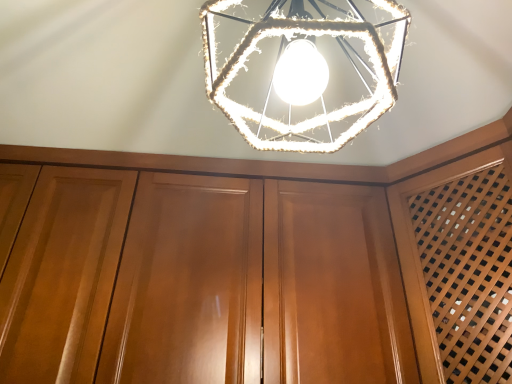
Question: From the image's perspective, does rope-wrapped hexagonal light at center appear lower than glossy wood dresser at center?

Choices:
 (A) yes
 (B) no

Answer: (B)

Question: Is rope-wrapped hexagonal light at center to the right of glossy wood dresser at center from the viewer's perspective?

Choices:
 (A) no
 (B) yes

Answer: (B)

Question: Can you confirm if rope-wrapped hexagonal light at center is taller than glossy wood dresser at center?

Choices:
 (A) yes
 (B) no

Answer: (B)

Question: Does rope-wrapped hexagonal light at center lie in front of glossy wood dresser at center?

Choices:
 (A) no
 (B) yes

Answer: (B)

Question: From the image's perspective, is rope-wrapped hexagonal light at center over glossy wood dresser at center?

Choices:
 (A) yes
 (B) no

Answer: (A)

Question: Is rope-wrapped hexagonal light at center positioned beyond the bounds of glossy wood dresser at center?

Choices:
 (A) no
 (B) yes

Answer: (B)

Question: Does glossy wood dresser at center contain rope-wrapped hexagonal light at center?

Choices:
 (A) yes
 (B) no

Answer: (B)

Question: Is glossy wood dresser at center positioned with its back to rope-wrapped hexagonal light at center?

Choices:
 (A) no
 (B) yes

Answer: (A)

Question: Does glossy wood dresser at center appear on the left side of rope-wrapped hexagonal light at center?

Choices:
 (A) no
 (B) yes

Answer: (B)

Question: Is glossy wood dresser at center not close to rope-wrapped hexagonal light at center?

Choices:
 (A) yes
 (B) no

Answer: (B)

Question: Can you confirm if glossy wood dresser at center is taller than rope-wrapped hexagonal light at center?

Choices:
 (A) no
 (B) yes

Answer: (B)

Question: Is glossy wood dresser at center wider than rope-wrapped hexagonal light at center?

Choices:
 (A) no
 (B) yes

Answer: (B)

Question: Choose the correct answer: Is glossy wood dresser at center inside rope-wrapped hexagonal light at center or outside it?

Choices:
 (A) inside
 (B) outside

Answer: (B)